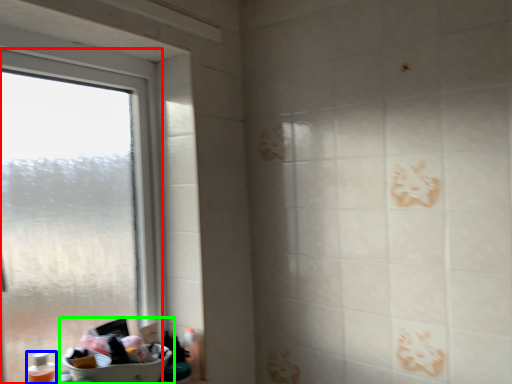
Question: Considering the real-world distances, which object is farthest from window (highlighted by a red box)? toiletry (highlighted by a blue box) or sink (highlighted by a green box)?

Choices:
 (A) toiletry
 (B) sink

Answer: (A)